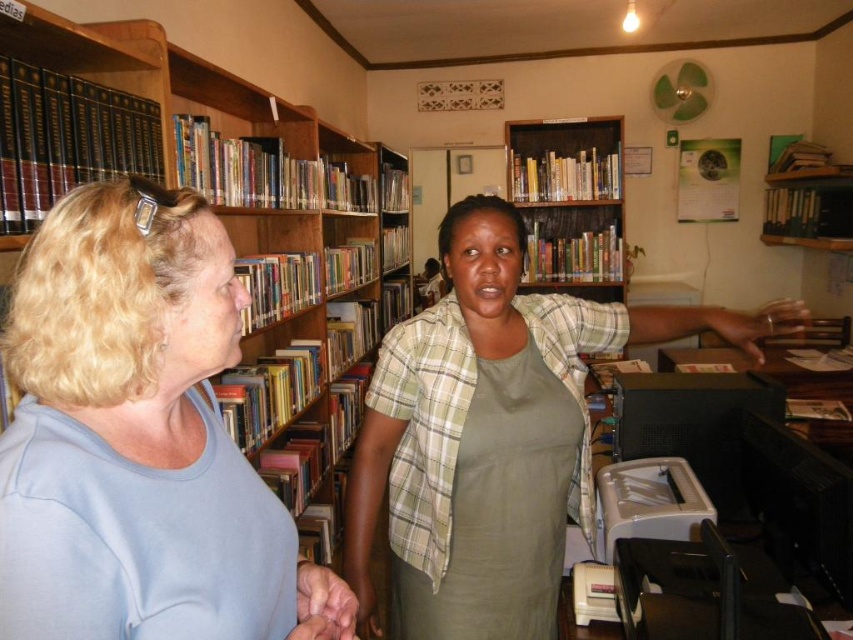
Question: Which object is positioned farthest from the green fabric apron at center?

Choices:
 (A) green cotton shirt at center
 (B) wooden bookshelf at upper center
 (C) light blue cotton shirt at left

Answer: (B)

Question: Observing the image, what is the correct spatial positioning of green fabric apron at center in reference to wooden bookshelf at upper center?

Choices:
 (A) right
 (B) left

Answer: (B)

Question: Can you confirm if light blue cotton shirt at left is thinner than green cotton shirt at center?

Choices:
 (A) yes
 (B) no

Answer: (A)

Question: Which of the following is the closest to the observer?

Choices:
 (A) wooden bookshelf at upper center
 (B) green fabric apron at center
 (C) light blue cotton shirt at left
 (D) green cotton shirt at center

Answer: (C)

Question: Can you confirm if light blue cotton shirt at left is smaller than wooden bookshelf at upper center?

Choices:
 (A) no
 (B) yes

Answer: (B)

Question: Estimate the real-world distances between objects in this image. Which object is closer to the green cotton shirt at center?

Choices:
 (A) light blue cotton shirt at left
 (B) green fabric apron at center
 (C) wooden bookshelf at upper center

Answer: (B)